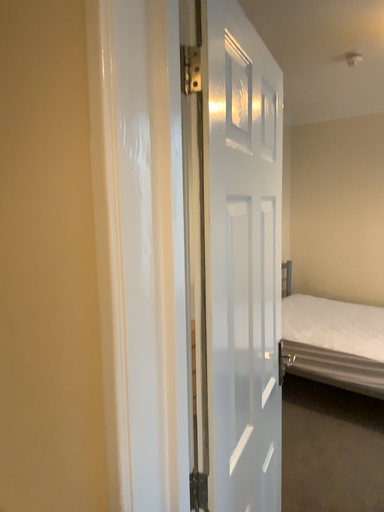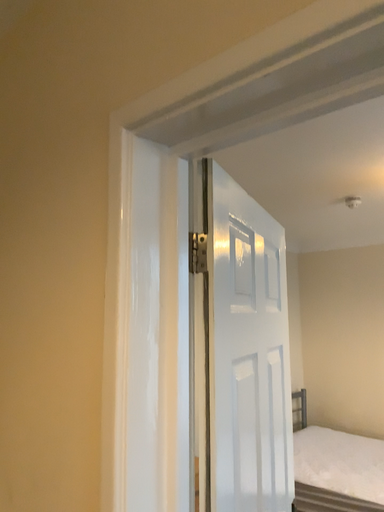
Question: Which way did the camera rotate in the video?

Choices:
 (A) rotated downward
 (B) rotated upward

Answer: (B)